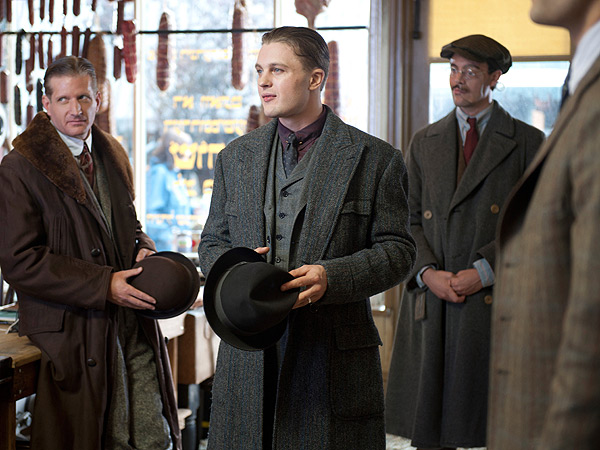
The width and height of the screenshot is (600, 450). In order to click on glass in this screenshot , I will do `click(182, 163)`.